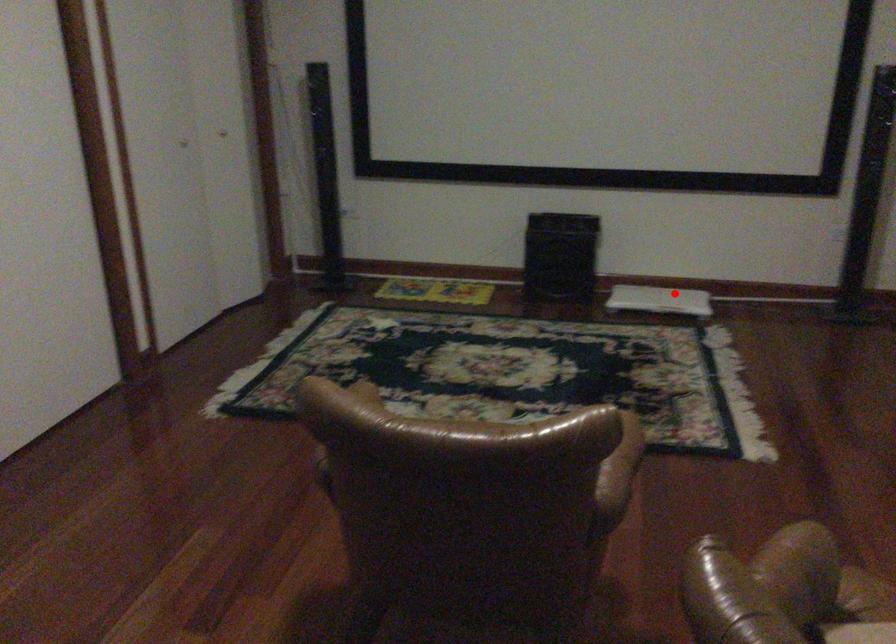
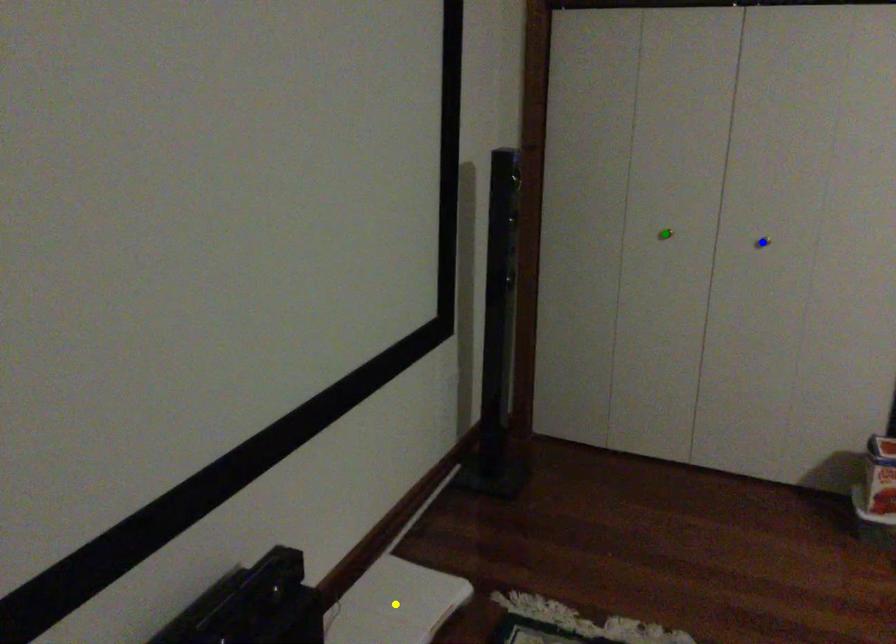
Question: I am providing you with two images of the same scene from different viewpoints. A red point is marked on the first image. You are given multiple points on the second image. Which spot in image 2 lines up with the point in image 1?

Choices:
 (A) yellow point
 (B) blue point
 (C) green point

Answer: (A)